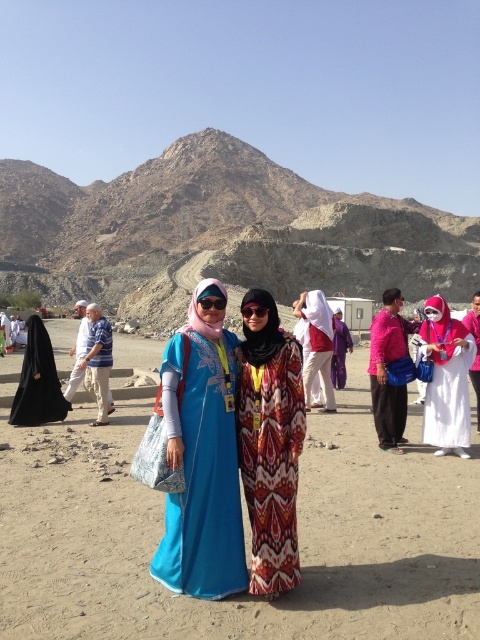
You are a photographer trying to capture both the printed fabric dress at center and the matte white dress at center in the same frame. Based on their positions, which dress will appear closer to the camera in the photo?

The printed fabric dress at center appears closer to the camera because it is positioned in front of the matte white dress at center.

You are a photographer positioned at the edge of the desert landscape. You want to capture a wide shot that includes both the printed fabric dress at center and the matte white dress at center in the same frame. Given that your camera has a maximum focal length that allows a field of view covering 15 meters, will you be able to include both subjects in your photo?

The distance between the printed fabric dress at center and the matte white dress at center is 10.76 meters, which is within the camera field of view of 15 meters. Therefore, both subjects can be captured in the same frame.

You are standing at the point marked as point (439, 387) in the desert scene. A tour guide is asking you to walk towards the nearest mountain range that is 126.60 feet away from your current position. Can you reach the mountain range within 2 minutes if you walk at a speed of 3 feet per second?

The distance to the mountain range is 126.60 feet. Walking at 3 feet per second, it would take 42.2 seconds to cover that distance. Since 42.2 seconds is less than 2 minutes, you can reach the mountain range within the time limit.